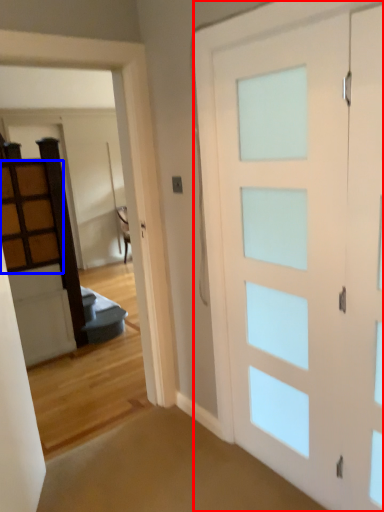
Question: Which point is further to the camera, barn door (highlighted by a red box) or cabinetry (highlighted by a blue box)?

Choices:
 (A) barn door
 (B) cabinetry

Answer: (B)